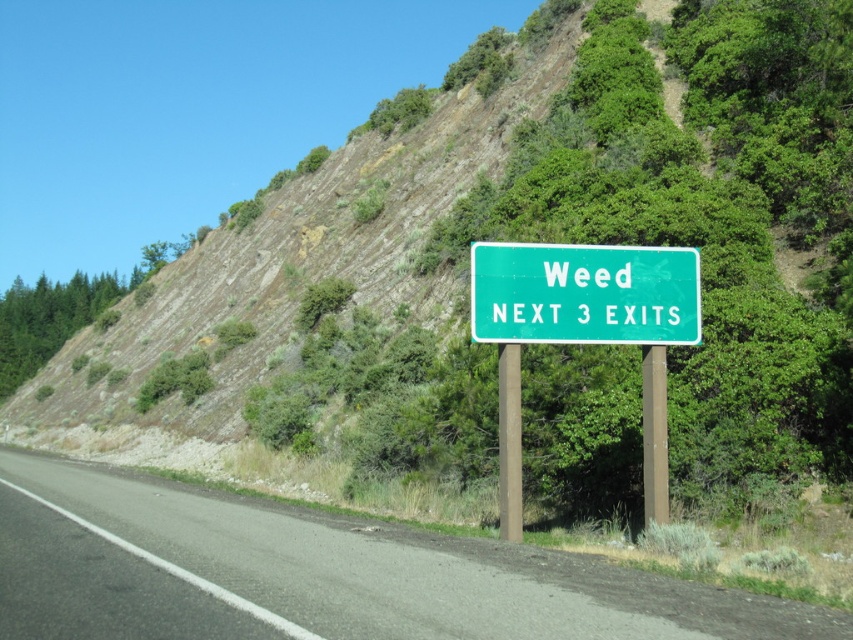
You are a delivery driver navigating a two lane road. You see a point at coordinates (320,573). Is this point on the asphalt road at center?

Yes, the point at coordinates (320,573) is on the asphalt road at center, so the delivery driver can safely drive over it.

You are driving on the asphalt road at center and notice the green metallic sign at center above you. Is the sign directly above the road or to the side?

The asphalt road at center is positioned under green metallic sign at center, so the sign is directly above the road.